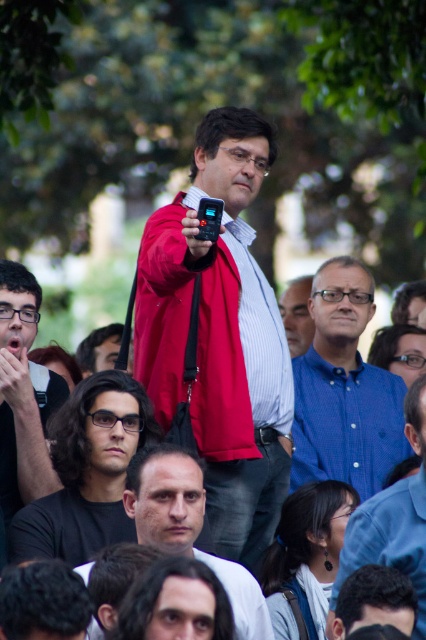
Question: Which of the following is the farthest from the observer?

Choices:
 (A) matte black glasses at left
 (B) matte black phone at center

Answer: (A)

Question: Is smooth black hair at center wider than blue button-down shirt at center-right?

Choices:
 (A) yes
 (B) no

Answer: (A)

Question: Is matte black glasses at left behind smooth black hair at center?

Choices:
 (A) no
 (B) yes

Answer: (B)

Question: Which is nearer to the black matte shirt at lower left?

Choices:
 (A) matte black glasses at left
 (B) blue button-down shirt at center
 (C) smooth black hair at center

Answer: (C)

Question: Among these points, which one is nearest to the camera?

Choices:
 (A) (83, 518)
 (B) (6, 378)
 (C) (348, 564)
 (D) (333, 326)

Answer: (C)

Question: Is matte black phone at center to the left of blue button-down shirt at center from the viewer's perspective?

Choices:
 (A) no
 (B) yes

Answer: (B)